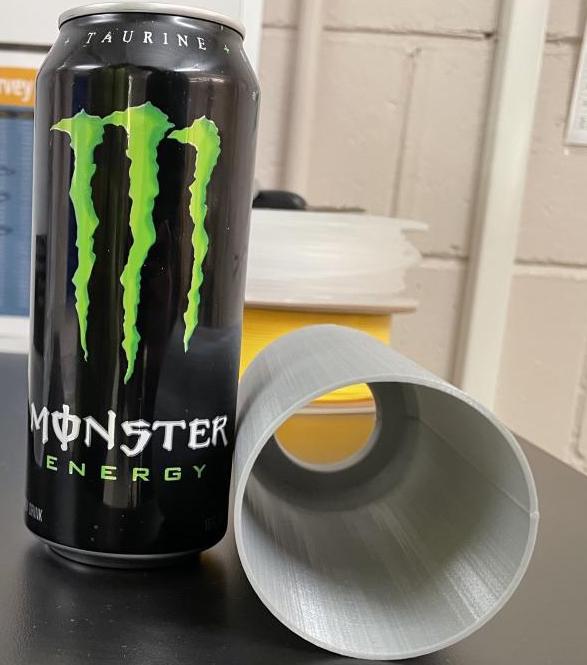
Image resolution: width=587 pixels, height=665 pixels. In order to click on white blue poster in this screenshot , I will do `click(301, 261)`, `click(20, 146)`.